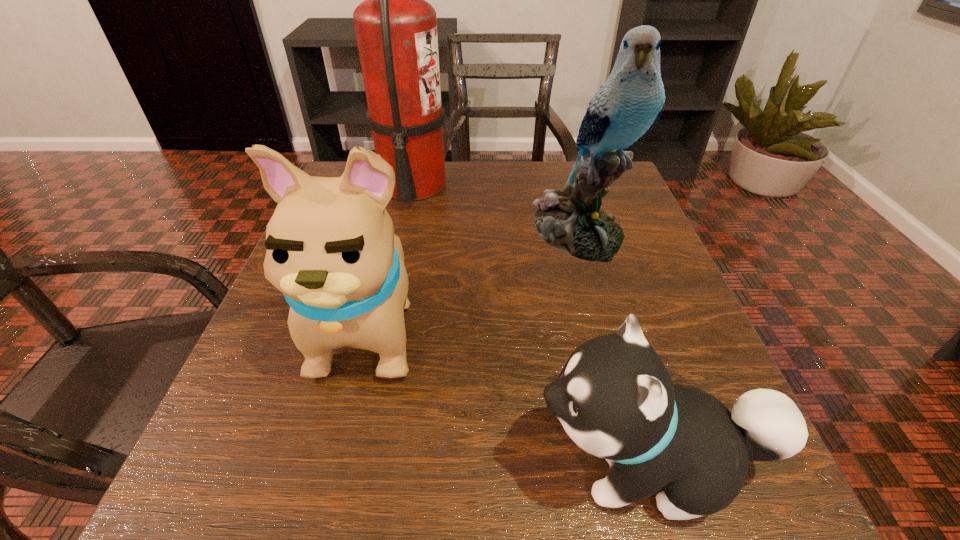
Locate an element on the screen. This screenshot has width=960, height=540. free point between the second shortest object and the third shortest object is located at coordinates (474, 279).

Identify the location of free space between the third shortest object and the tallest object. Image resolution: width=960 pixels, height=540 pixels. (495, 210).

Find the location of a particular element. This screenshot has width=960, height=540. blank region between the right puppy and the farther puppy is located at coordinates (510, 395).

The width and height of the screenshot is (960, 540). I want to click on vacant area that lies between the tallest object and the second tallest object, so click(495, 210).

I want to click on empty space that is in between the tallest object and the second tallest object, so click(495, 210).

Locate an element on the screen. object identified as the closest to the parakeet is located at coordinates (396, 29).

Point out which object is positioned as the second nearest to the fire extinguisher. Please provide its 2D coordinates. Your answer should be formatted as a tuple, i.e. [(x, y)], where the tuple contains the x and y coordinates of a point satisfying the conditions above.

[(627, 106)]

Find the location of `free space that satisfies the following two spatial constraints: 1. toward the nozzle of the tallest object; 2. on the face of the third tallest object`. free space that satisfies the following two spatial constraints: 1. toward the nozzle of the tallest object; 2. on the face of the third tallest object is located at coordinates (383, 326).

At what (x,y) coordinates should I click in order to perform the action: click on vacant area that satisfies the following two spatial constraints: 1. toward the nozzle of the tallest object; 2. on the face of the taller puppy. Please return your answer as a coordinate pair (x, y). This screenshot has width=960, height=540. Looking at the image, I should click on (383, 326).